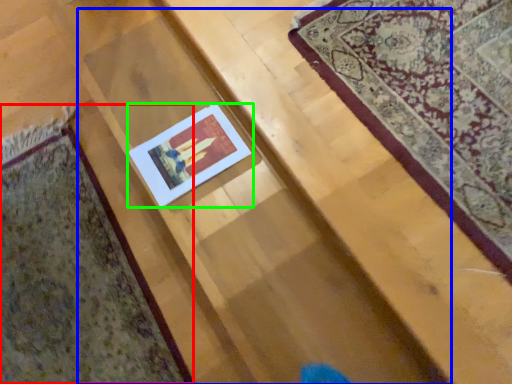
Question: Which is nearer to the mat (highlighted by a red box)? stairwell (highlighted by a blue box) or picture frame (highlighted by a green box).

Choices:
 (A) stairwell
 (B) picture frame

Answer: (A)